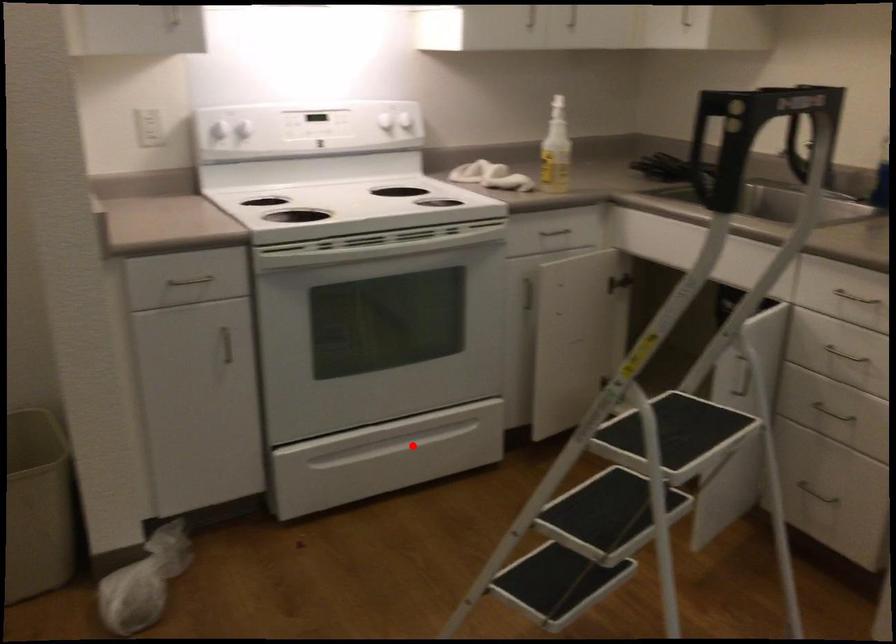
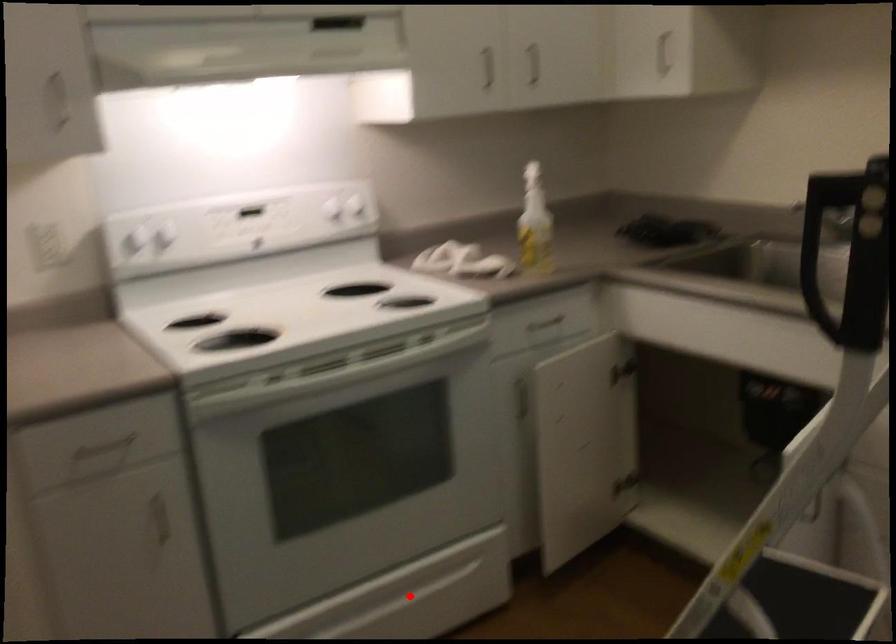
I am providing you with two images of the same scene from different viewpoints. A red point is marked on the first image and another point is marked on the second image. Do the highlighted points in image1 and image2 indicate the same real-world spot?

Yes